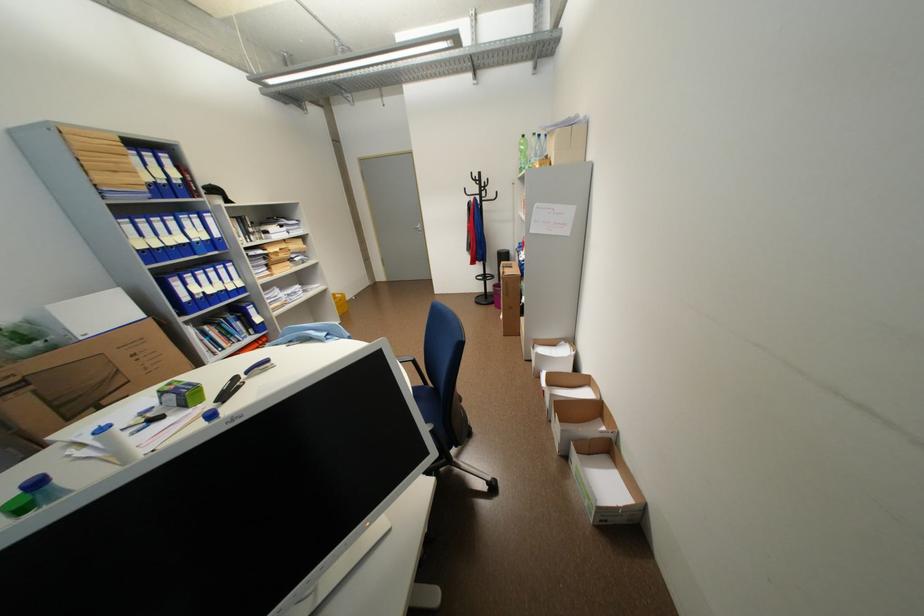
Where would you lift the yellow waste bin? Please return your answer as a coordinate pair (x, y).

(339, 302)